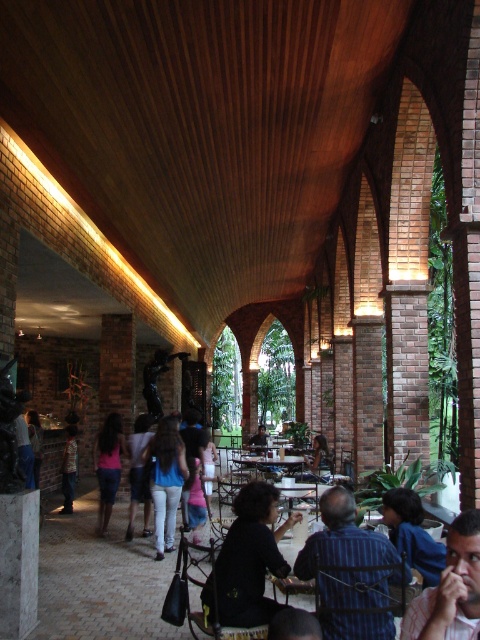
Question: Among these objects, which one is nearest to the camera?

Choices:
 (A) black matte shirt at center
 (B) black leather jacket at center

Answer: (A)

Question: Which point is closer to the camera?

Choices:
 (A) blue striped shirt at center
 (B) pink fabric dress at center

Answer: (A)

Question: Which point appears farthest from the camera in this image?

Choices:
 (A) (349, 552)
 (B) (254, 444)
 (C) (257, 458)
 (D) (240, 556)

Answer: (B)

Question: Does black matte shirt at center appear under striped shirt at center?

Choices:
 (A) no
 (B) yes

Answer: (A)

Question: Is pink shirt at center to the left of striped shirt at center from the viewer's perspective?

Choices:
 (A) yes
 (B) no

Answer: (B)

Question: Does striped shirt at center have a smaller size compared to matte black shirt at center?

Choices:
 (A) no
 (B) yes

Answer: (B)